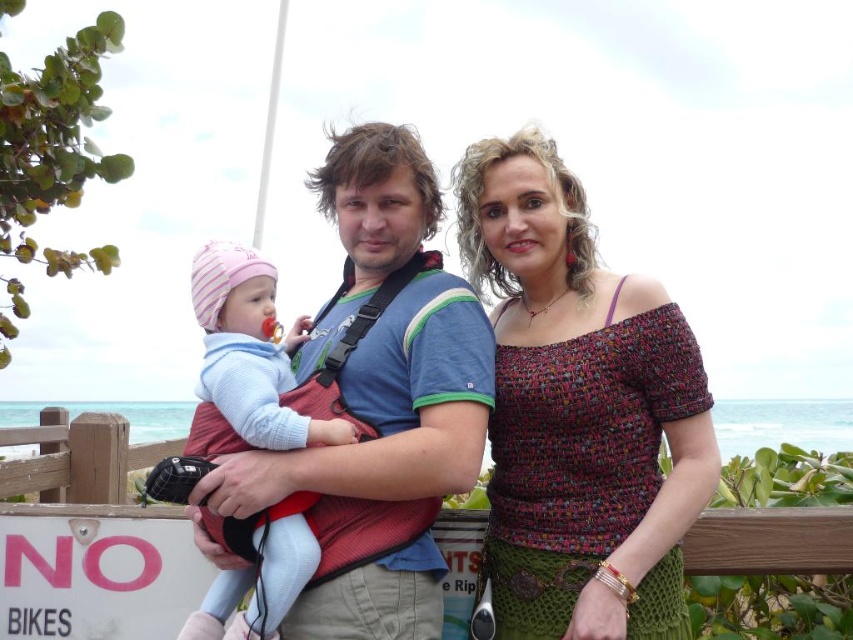
In the scene shown: Can you confirm if multicolored woven top at center is positioned above matte blue shirt at center?

No, multicolored woven top at center is not above matte blue shirt at center.

Is multicolored woven top at center closer to the viewer compared to matte blue shirt at center?

Yes, multicolored woven top at center is in front of matte blue shirt at center.

The width and height of the screenshot is (853, 640). In order to click on multicolored woven top at center in this screenshot , I will do `click(579, 410)`.

Is multicolored woven top at center to the right of light blue knit sweater at center from the viewer's perspective?

Yes, multicolored woven top at center is to the right of light blue knit sweater at center.

Who is positioned more to the left, multicolored woven top at center or light blue knit sweater at center?

Positioned to the left is light blue knit sweater at center.

This screenshot has width=853, height=640. What do you see at coordinates (579, 410) in the screenshot?
I see `multicolored woven top at center` at bounding box center [579, 410].

You are a GUI agent. You are given a task and a screenshot of the screen. Output one action in this format:
    pyautogui.click(x=<x>, y=<y>)
    Task: Click on the multicolored woven top at center
    This screenshot has height=640, width=853.
    Given the screenshot: What is the action you would take?
    pyautogui.click(x=579, y=410)

Does matte blue shirt at center have a lesser width compared to light blue knit sweater at center?

No.

Does matte blue shirt at center have a smaller size compared to light blue knit sweater at center?

Actually, matte blue shirt at center might be larger than light blue knit sweater at center.

Is point (289, 620) more distant than point (258, 348)?

No.

This screenshot has height=640, width=853. I want to click on matte blue shirt at center, so click(x=390, y=410).